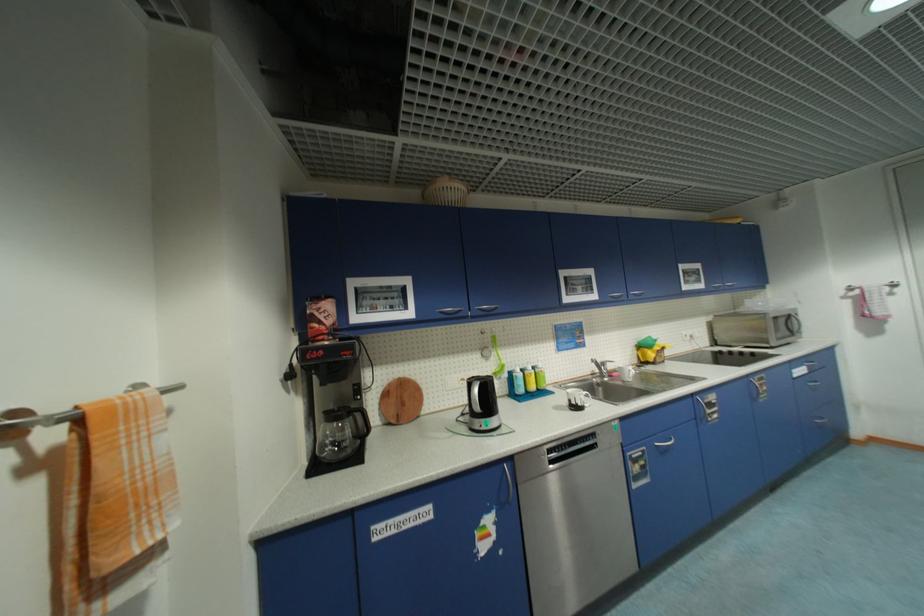
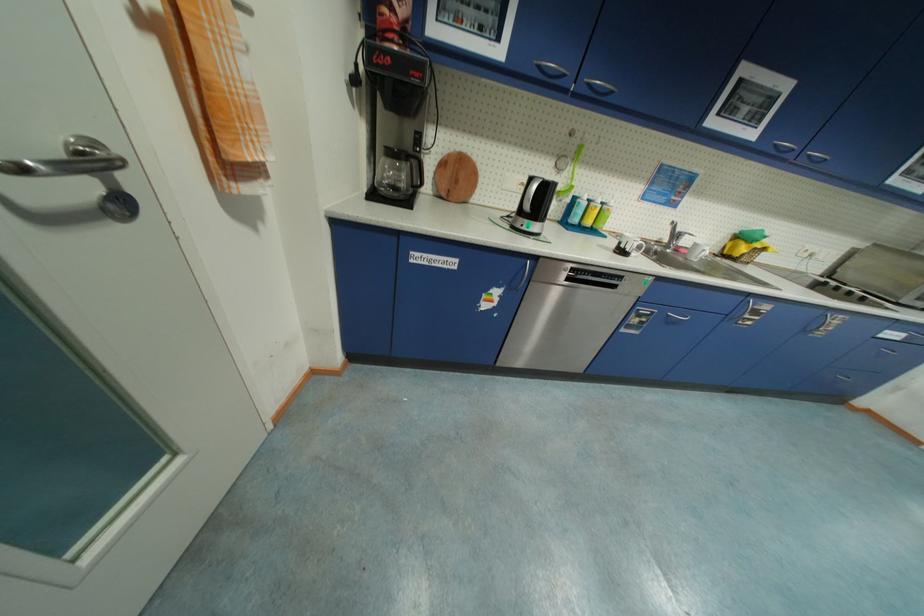
In the second image, find the point that corresponds to (363,416) in the first image.

(420, 163)